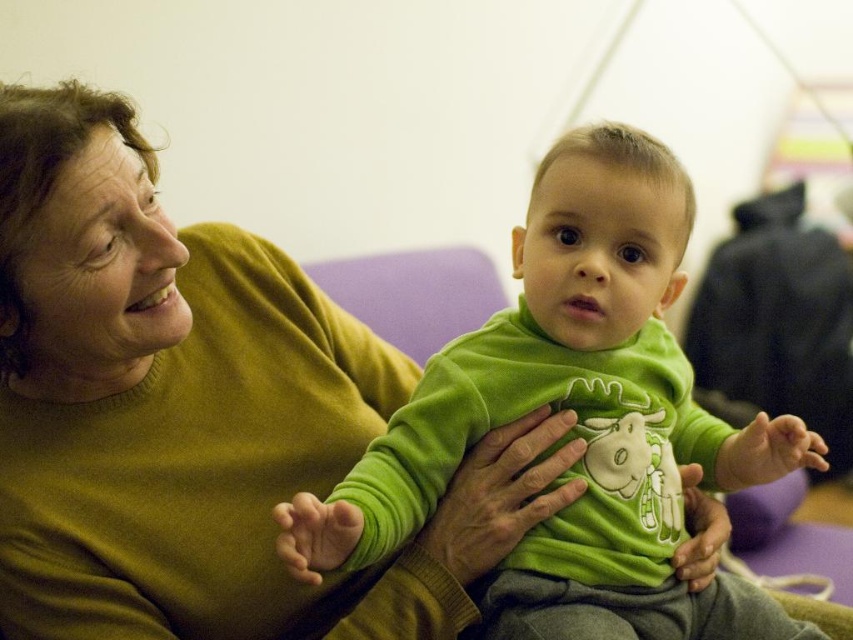
In the scene shown: Measure the distance between matte green sweater at center and green velvety shirt at center.

They are 19.33 centimeters apart.

Between matte green sweater at center and green velvety shirt at center, which one is positioned higher?

green velvety shirt at center

Who is more forward, (219, 356) or (743, 433)?

Positioned in front is point (743, 433).

The image size is (853, 640). I want to click on matte green sweater at center, so 198,413.